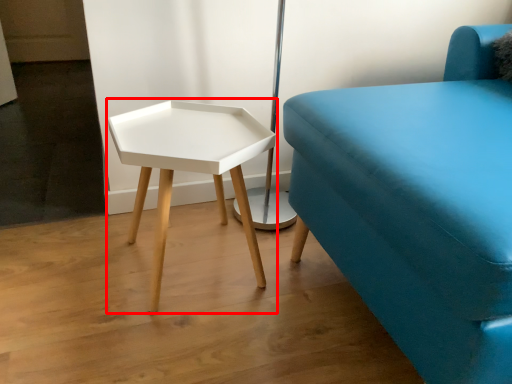
Question: From the image's perspective, considering the relative positions of table (annotated by the red box) and studio couch in the image provided, where is table (annotated by the red box) located with respect to the staircase?

Choices:
 (A) above
 (B) below

Answer: (B)